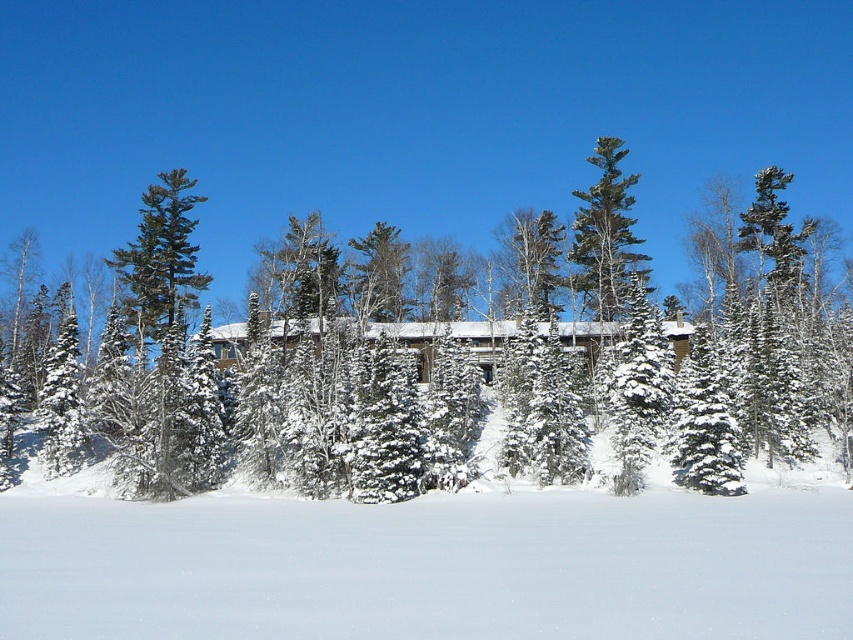
Which is more to the right, white fluffy snow at lower center or green textured pine tree at upper center?

green textured pine tree at upper center is more to the right.

Is white fluffy snow at lower center positioned in front of green textured pine tree at upper center?

Yes, it is.

You are a GUI agent. You are given a task and a screenshot of the screen. Output one action in this format:
    pyautogui.click(x=<x>, y=<y>)
    Task: Click on the white fluffy snow at lower center
    This screenshot has width=853, height=640.
    Given the screenshot: What is the action you would take?
    pyautogui.click(x=428, y=566)

You are a GUI agent. You are given a task and a screenshot of the screen. Output one action in this format:
    pyautogui.click(x=<x>, y=<y>)
    Task: Click on the white fluffy snow at lower center
    This screenshot has width=853, height=640.
    Given the screenshot: What is the action you would take?
    (428, 566)